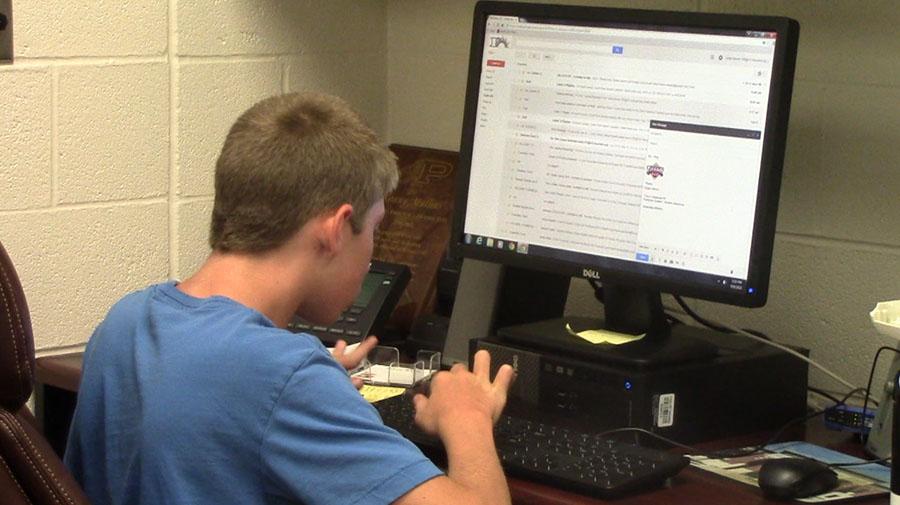
Where is `computer monitor`? computer monitor is located at coordinates (633, 271).